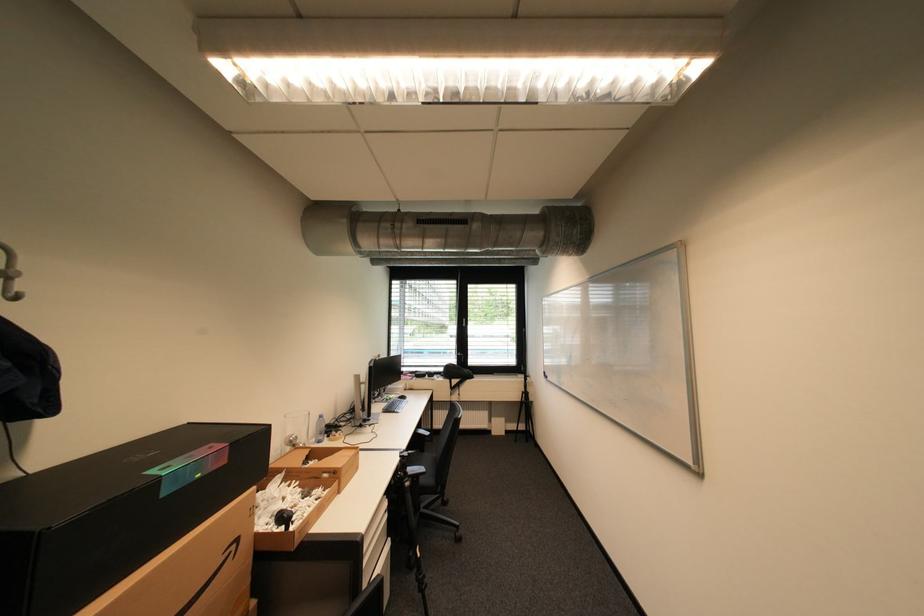
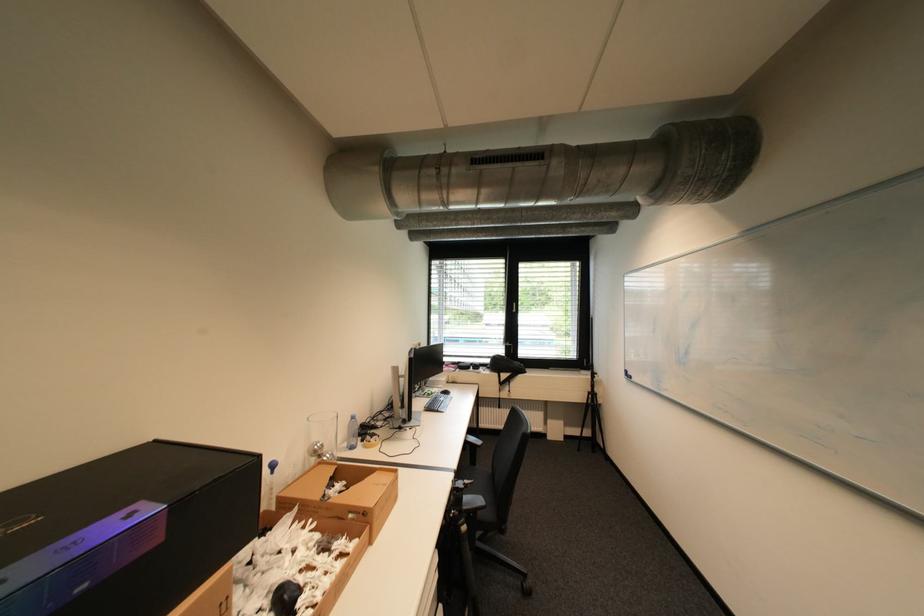
Question: Based on the continuous images, in which direction is the camera rotating? Reply with the corresponding letter.

Choices:
 (A) Left
 (B) Right
 (C) Up
 (D) Down

Answer: (A)